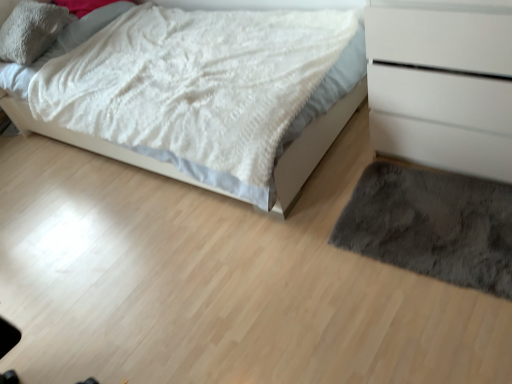
Question: Does dark gray shaggy rug at lower right have a greater width compared to soft gray plush pillow at upper left?

Choices:
 (A) no
 (B) yes

Answer: (B)

Question: Considering the relative sizes of dark gray shaggy rug at lower right and soft gray plush pillow at upper left in the image provided, is dark gray shaggy rug at lower right thinner than soft gray plush pillow at upper left?

Choices:
 (A) yes
 (B) no

Answer: (B)

Question: Does dark gray shaggy rug at lower right lie behind soft gray plush pillow at upper left?

Choices:
 (A) no
 (B) yes

Answer: (A)

Question: Is dark gray shaggy rug at lower right touching soft gray plush pillow at upper left?

Choices:
 (A) no
 (B) yes

Answer: (A)

Question: Is the depth of dark gray shaggy rug at lower right less than that of soft gray plush pillow at upper left?

Choices:
 (A) no
 (B) yes

Answer: (B)

Question: Is white matte chest of drawers at right bigger or smaller than dark gray shaggy rug at lower right?

Choices:
 (A) big
 (B) small

Answer: (A)

Question: From their relative heights in the image, would you say white matte chest of drawers at right is taller or shorter than dark gray shaggy rug at lower right?

Choices:
 (A) short
 (B) tall

Answer: (B)

Question: Is white matte chest of drawers at right wider or thinner than dark gray shaggy rug at lower right?

Choices:
 (A) thin
 (B) wide

Answer: (B)

Question: In the image, is white matte chest of drawers at right on the left side or the right side of dark gray shaggy rug at lower right?

Choices:
 (A) left
 (B) right

Answer: (B)

Question: Do you think white fluffy blanket at upper left is within soft gray plush pillow at upper left, or outside of it?

Choices:
 (A) inside
 (B) outside

Answer: (B)

Question: Considering the positions of white fluffy blanket at upper left and soft gray plush pillow at upper left in the image, is white fluffy blanket at upper left wider or thinner than soft gray plush pillow at upper left?

Choices:
 (A) thin
 (B) wide

Answer: (B)

Question: Considering their positions, is white fluffy blanket at upper left located in front of or behind soft gray plush pillow at upper left?

Choices:
 (A) front
 (B) behind

Answer: (A)

Question: Visually, is white fluffy blanket at upper left positioned to the left or to the right of soft gray plush pillow at upper left?

Choices:
 (A) right
 (B) left

Answer: (A)

Question: Considering the positions of white fluffy blanket at upper left and white matte chest of drawers at right in the image, is white fluffy blanket at upper left bigger or smaller than white matte chest of drawers at right?

Choices:
 (A) big
 (B) small

Answer: (A)

Question: Is white fluffy blanket at upper left in front of or behind white matte chest of drawers at right in the image?

Choices:
 (A) front
 (B) behind

Answer: (B)